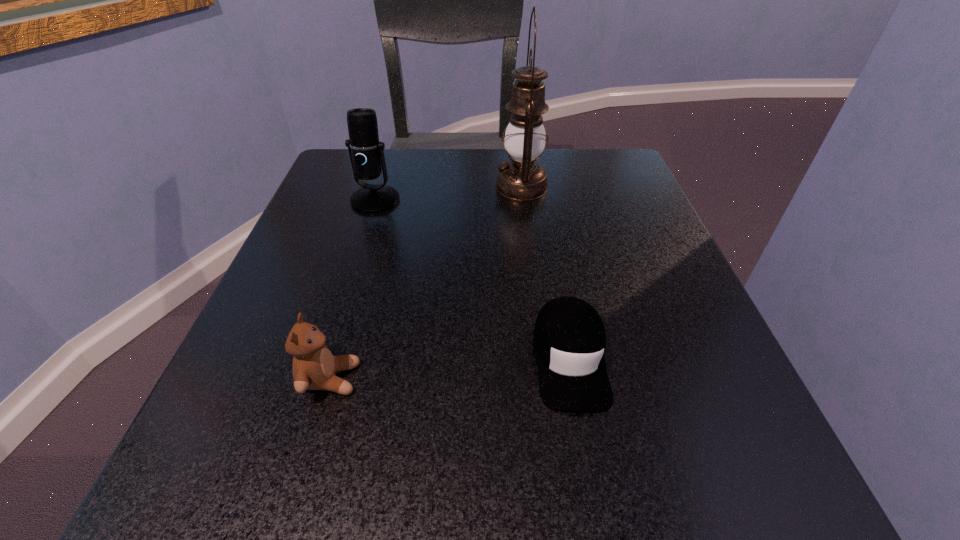
I want to click on microphone located in the left edge section of the desktop, so click(x=366, y=153).

At what (x,y) coordinates should I click in order to perform the action: click on teddy bear that is at the left edge. Please return your answer as a coordinate pair (x, y). Image resolution: width=960 pixels, height=540 pixels. Looking at the image, I should click on (314, 367).

Identify the location of object at the far left corner. (366, 153).

Locate an element on the screen. This screenshot has height=540, width=960. free space at the far edge of the desktop is located at coordinates (498, 157).

Where is `vacant position at the near edge of the desktop`? vacant position at the near edge of the desktop is located at coordinates (517, 448).

The height and width of the screenshot is (540, 960). In the image, there is a desktop. In order to click on vacant space at the left edge in this screenshot , I will do `click(361, 232)`.

Where is `vacant space at the right edge`? Image resolution: width=960 pixels, height=540 pixels. vacant space at the right edge is located at coordinates tap(637, 413).

This screenshot has height=540, width=960. I want to click on free space at the far right corner, so click(x=578, y=196).

In the image, there is a desktop. Where is `free region at the near right corner`? free region at the near right corner is located at coordinates (681, 454).

At what (x,y) coordinates should I click in order to perform the action: click on blank region between the second shortest object and the microphone. Please return your answer as a coordinate pair (x, y). Looking at the image, I should click on (353, 289).